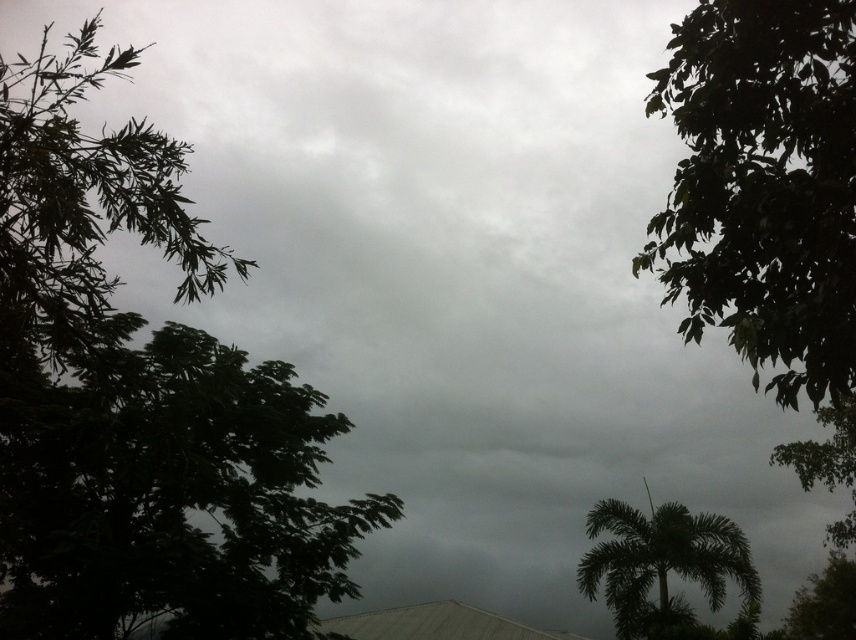
Can you confirm if green leafy tree at left is positioned below green leafy palm tree at lower right?

Incorrect, green leafy tree at left is not positioned below green leafy palm tree at lower right.

Is point (198, 508) less distant than point (669, 602)?

Yes, point (198, 508) is closer to viewer.

Between point (260, 634) and point (640, 618), which one is positioned in front?

Positioned in front is point (260, 634).

I want to click on green leafy tree at left, so click(x=170, y=497).

Is green leafy tree at upper right above green leafy palm tree at lower right?

Correct, green leafy tree at upper right is located above green leafy palm tree at lower right.

Can you confirm if green leafy tree at upper right is wider than green leafy palm tree at lower right?

Yes, green leafy tree at upper right is wider than green leafy palm tree at lower right.

Image resolution: width=856 pixels, height=640 pixels. Describe the element at coordinates (764, 186) in the screenshot. I see `green leafy tree at upper right` at that location.

Identify the location of green leafy tree at upper right. (764, 186).

Can you confirm if green leafy tree at left is positioned to the left of green leafy tree at upper right?

Correct, you'll find green leafy tree at left to the left of green leafy tree at upper right.

Is point (358, 592) positioned behind point (825, 218)?

Yes, it is behind point (825, 218).

In order to click on green leafy tree at left in this screenshot , I will do `click(170, 497)`.